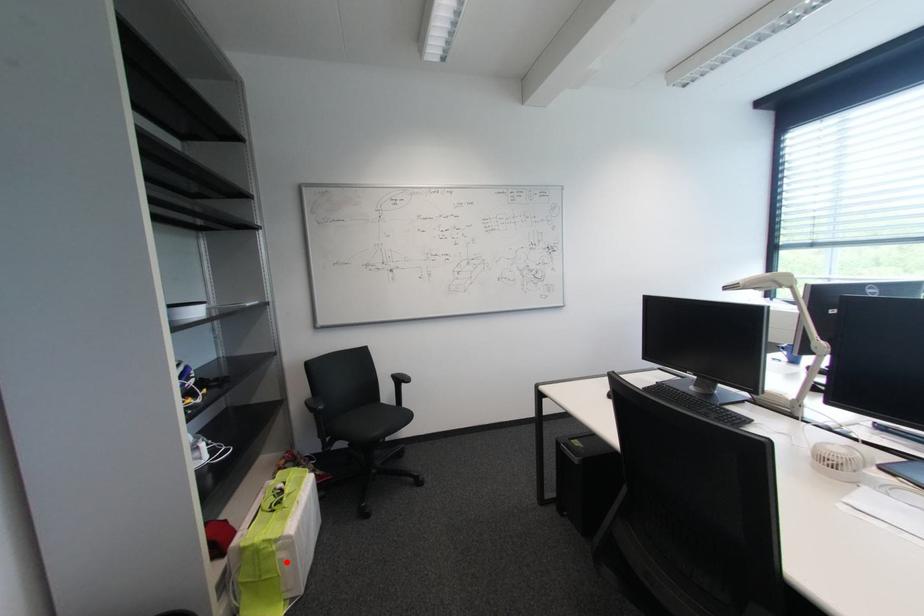
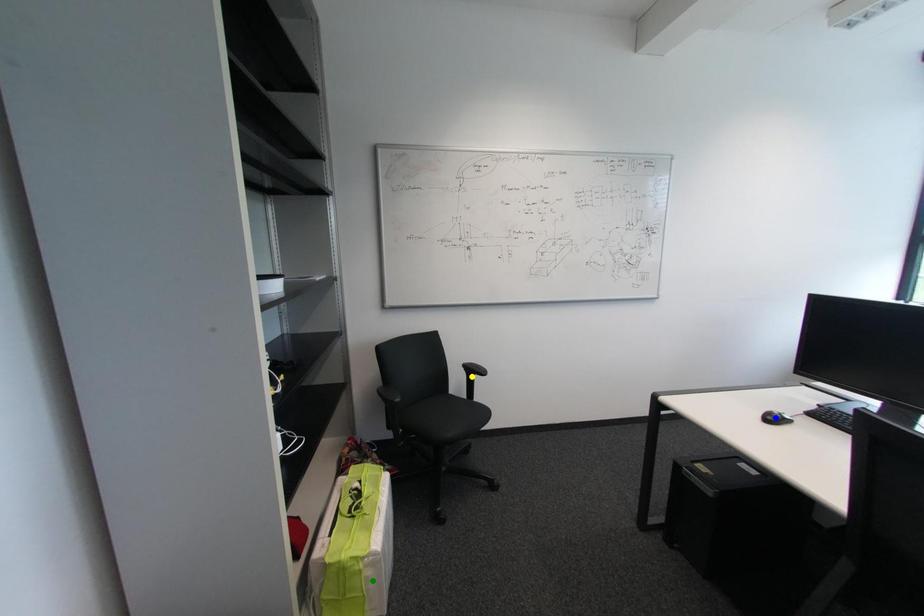
Question: I am providing you with two images of the same scene from different viewpoints. A red point is marked on the first image. You are given multiple points on the second image. Which spot in image 2 lines up with the point in image 1?

Choices:
 (A) blue point
 (B) yellow point
 (C) green point

Answer: (C)